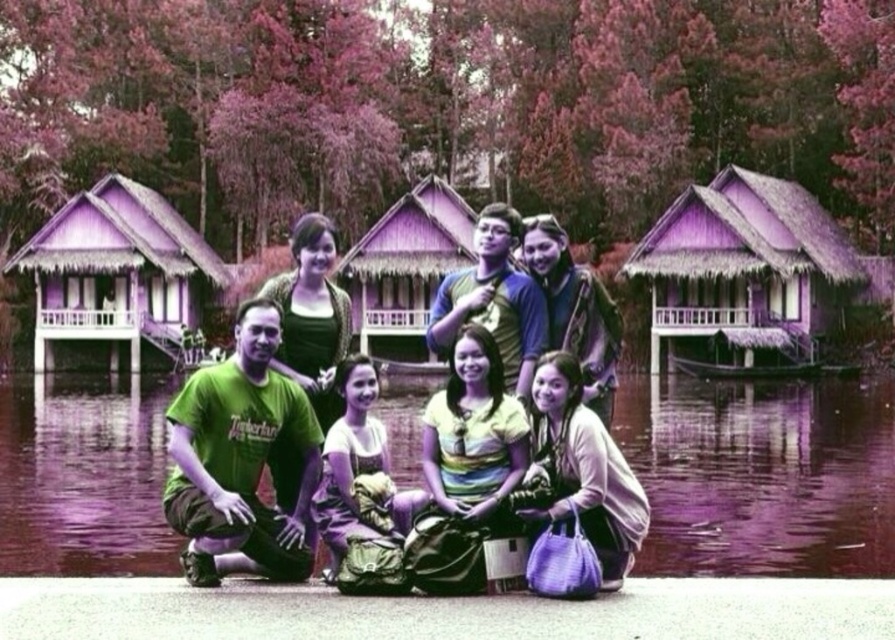
You are a photographer standing in the middle of the scene. You want to take a photo of both the purple wooden hut at right and the purple fabric bag at lower right. Which object should you adjust your camera focus to first to ensure it appears sharp in the foreground?

The purple wooden hut at right is closer to you than the purple fabric bag at lower right, so you should focus on the purple wooden hut at right first to ensure it appears sharp in the foreground.

You are a photographer trying to capture a closeup of the foreground people in the lakeside photo. You notice two points marked in the image at coordinates point [693,221] and point [629,529]. Which point should you focus on to ensure the foreground people are in sharp focus?

You should focus on point [693,221] because it is closer to the camera than point [629,529], ensuring the foreground people are in sharp focus.

You are a photographer standing at the lakeside and want to capture both the purple wooden hut at right and the purple fabric bag at lower right in a single frame. Given that your camera has a standard 50mm lens, which has a field of view of approximately 46 degrees, can you fit both objects into your photo without moving closer or farther away?

The purple wooden hut at right and purple fabric bag at lower right are 224.64 feet apart. With a 50mm lens providing a 46 degree field of view, the maximum distance between two objects that can be captured in a single frame would depend on the camera sensor size and focal length. However, given the significant distance of 224.64 feet between the two objects, it is unlikely that a standard 50mm lens would be able to capture both in the same frame without moving closer. The photographer would need to use a 1